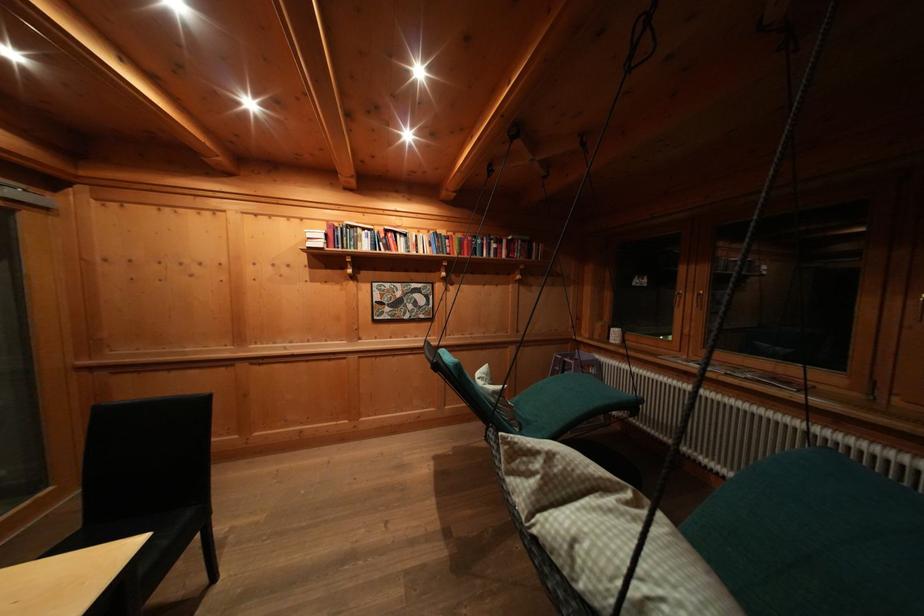
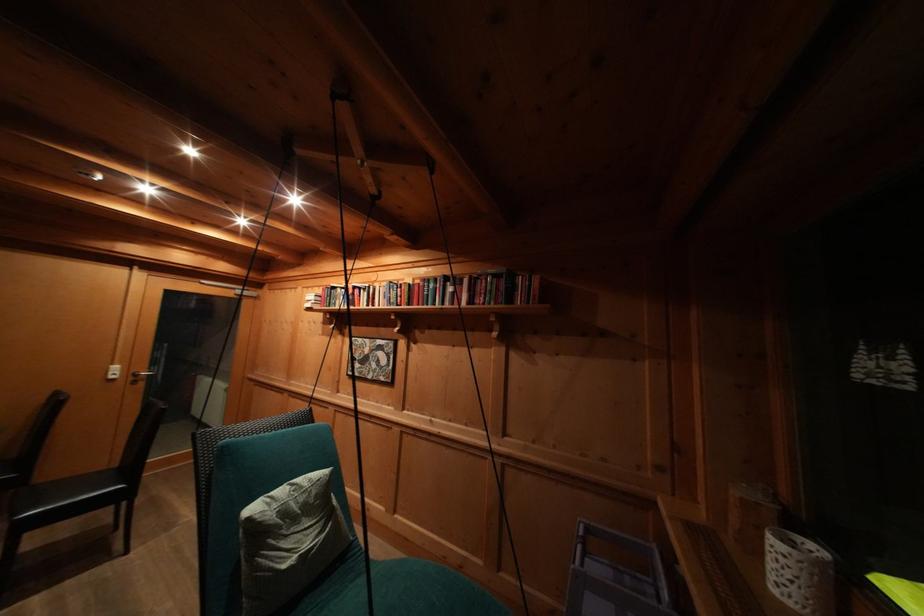
Locate, in the second image, the point that corresponds to point 618,346 in the first image.

(780, 594)